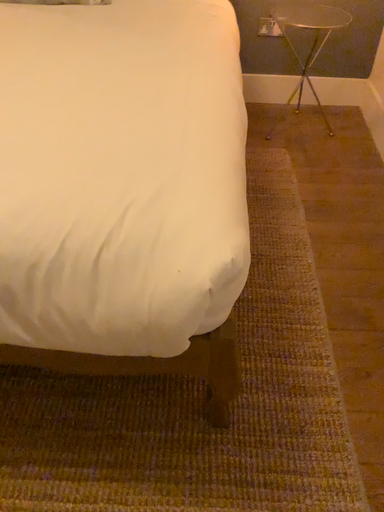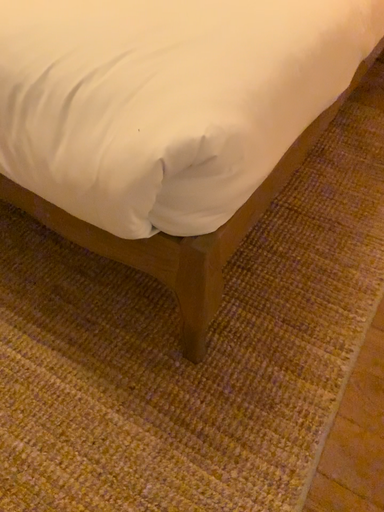
Question: Which way did the camera rotate in the video?

Choices:
 (A) rotated left
 (B) rotated right

Answer: (A)